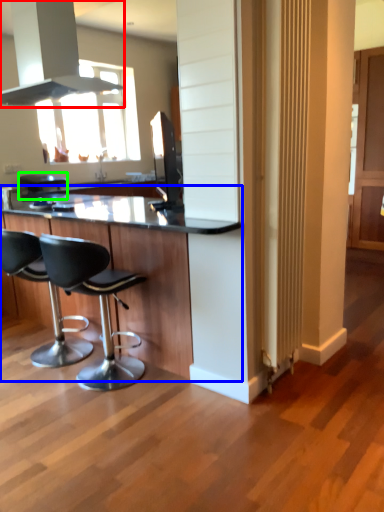
Question: Estimate the real-world distances between objects in this image. Which object is farther from exhaust hood (highlighted by a red box), table (highlighted by a blue box) or bar stool (highlighted by a green box)?

Choices:
 (A) table
 (B) bar stool

Answer: (B)